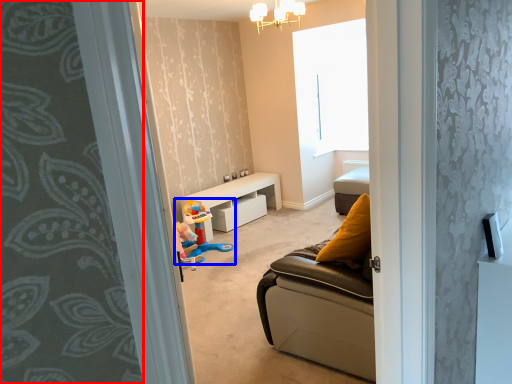
Question: Which object appears closest to the camera in this image, curtain (highlighted by a red box) or toy (highlighted by a blue box)?

Choices:
 (A) curtain
 (B) toy

Answer: (A)